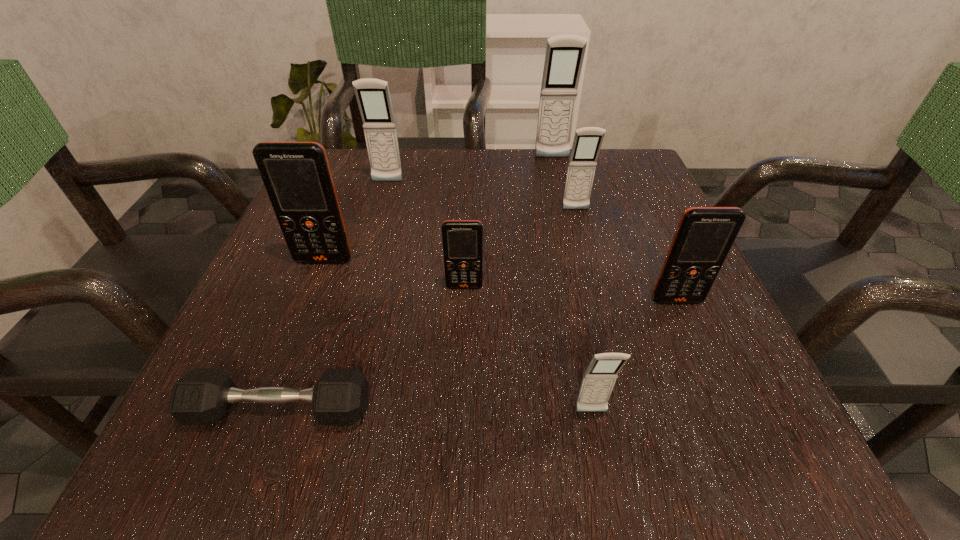
You are a GUI agent. You are given a task and a screenshot of the screen. Output one action in this format:
    pyautogui.click(x=<x>, y=<y>)
    Task: Click on the unoccupied area between the rightmost orange cellular telephone and the second nearest orange cellular telephone
    Image resolution: width=960 pixels, height=540 pixels.
    Given the screenshot: What is the action you would take?
    pyautogui.click(x=570, y=294)

Identify the location of vacant point located between the farthest object and the second farthest object. The height and width of the screenshot is (540, 960). (469, 170).

You are a GUI agent. You are given a task and a screenshot of the screen. Output one action in this format:
    pyautogui.click(x=<x>, y=<y>)
    Task: Click on the vacant area that lies between the shortest object and the sixth farthest object
    
    Given the screenshot: What is the action you would take?
    pyautogui.click(x=478, y=355)

Where is `free space that is in between the sixth nearest cellular telephone and the third farthest object`? free space that is in between the sixth nearest cellular telephone and the third farthest object is located at coordinates (482, 196).

Find the location of a particular element. This screenshot has width=960, height=540. free space between the dumbbell and the smallest gray cellular telephone is located at coordinates (435, 411).

Find the location of `vacant space that is in between the fifth object from right to left and the sixth nearest object`. vacant space that is in between the fifth object from right to left and the sixth nearest object is located at coordinates click(x=520, y=248).

Identify which object is located as the nearest to the third farthest object. Please provide its 2D coordinates. Your answer should be formatted as a tuple, i.e. [(x, y)], where the tuple contains the x and y coordinates of a point satisfying the conditions above.

[(564, 56)]

Identify the location of object that ranks as the seventh closest to the second nearest gray cellular telephone. (202, 396).

Identify which cellular telephone is located as the fourth nearest to the dumbbell. Please provide its 2D coordinates. Your answer should be formatted as a tuple, i.e. [(x, y)], where the tuple contains the x and y coordinates of a point satisfying the conditions above.

[(705, 235)]

The image size is (960, 540). Find the location of `cellular telephone that is the second closest to the smallest gray cellular telephone`. cellular telephone that is the second closest to the smallest gray cellular telephone is located at coordinates (462, 240).